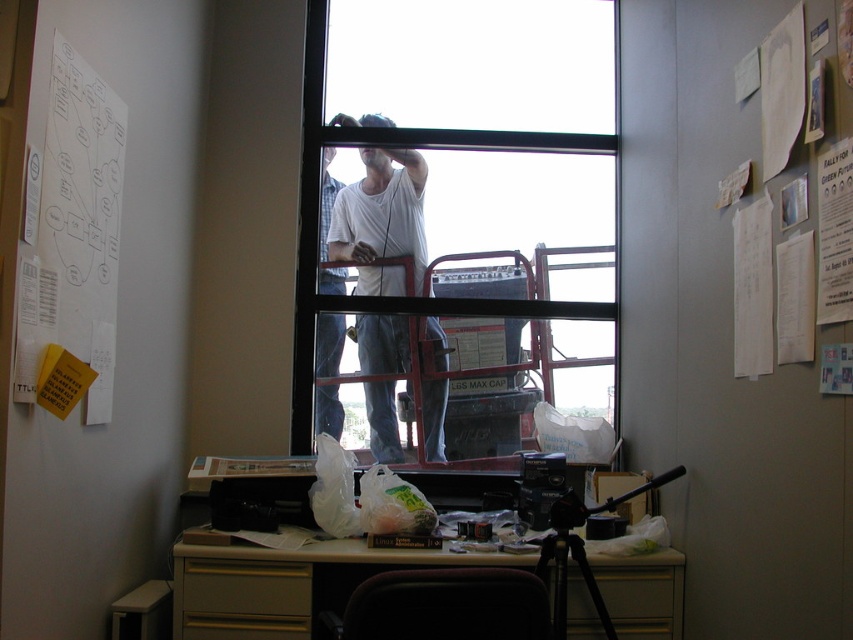
You are standing in the office and need to place a 3.5 feet long item between the white plastic table at center and the white matte shirt at center. Will there be enough space?

The white plastic table at center and white matte shirt at center are 3.52 feet apart, so placing a 3.5 feet long item between them would fit as the distance is slightly more than the item length.

From the picture: You are standing in the office and want to reach both points on the desk. Which point, point (654, 516) or point (378, 449), is closer to you?

Point (654, 516) is closer to you than point (378, 449).